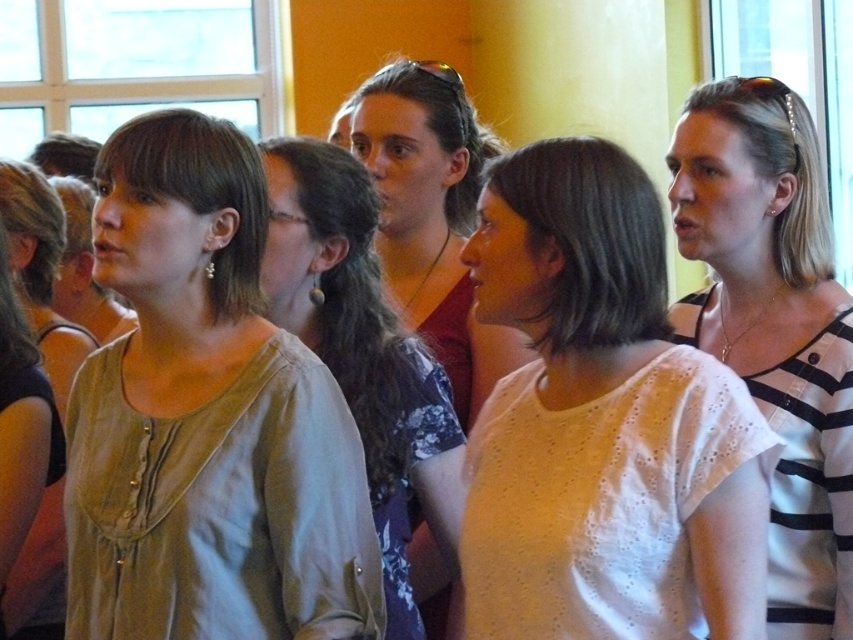
Is white striped shirt at right to the left of light beige blouse at center from the viewer's perspective?

No, white striped shirt at right is not to the left of light beige blouse at center.

Can you confirm if white striped shirt at right is thinner than light beige blouse at center?

No, white striped shirt at right is not thinner than light beige blouse at center.

Does point (814, 531) lie behind point (36, 545)?

No, it is not.

Where is `white striped shirt at right`? This screenshot has height=640, width=853. white striped shirt at right is located at coordinates (775, 324).

Is matte gray blouse at center shorter than light beige blouse at center?

Incorrect, matte gray blouse at center's height does not fall short of light beige blouse at center's.

Does point (318, 228) come in front of point (28, 211)?

Yes, point (318, 228) is closer to viewer.

Identify the location of matte gray blouse at center. (363, 349).

Between matte brown hair at center and light beige blouse at center, which one has more height?

Standing taller between the two is matte brown hair at center.

Which is above, matte brown hair at center or light beige blouse at center?

matte brown hair at center

Which is behind, point (387, 118) or point (20, 212)?

The point (387, 118) is behind.

Image resolution: width=853 pixels, height=640 pixels. Find the location of `matte brown hair at center`. matte brown hair at center is located at coordinates (432, 216).